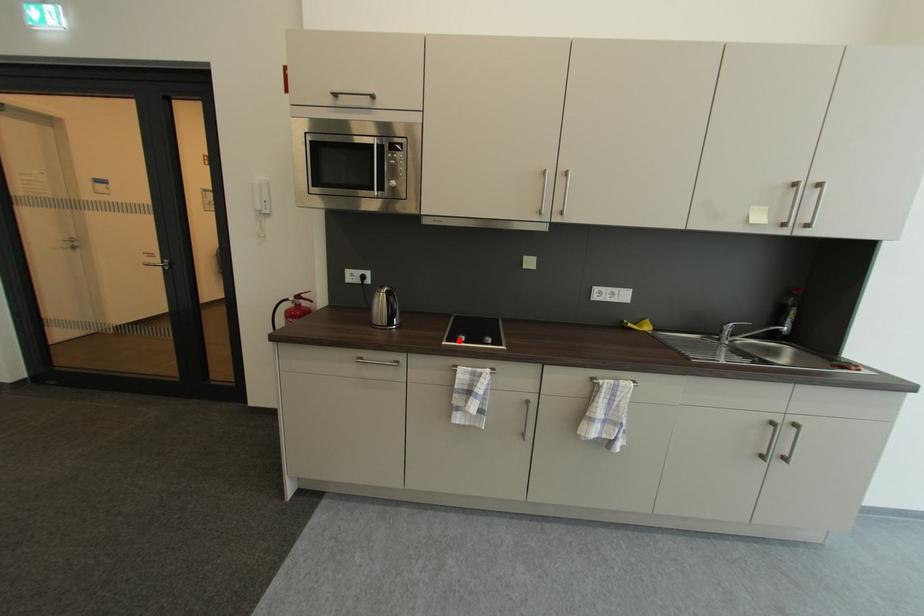
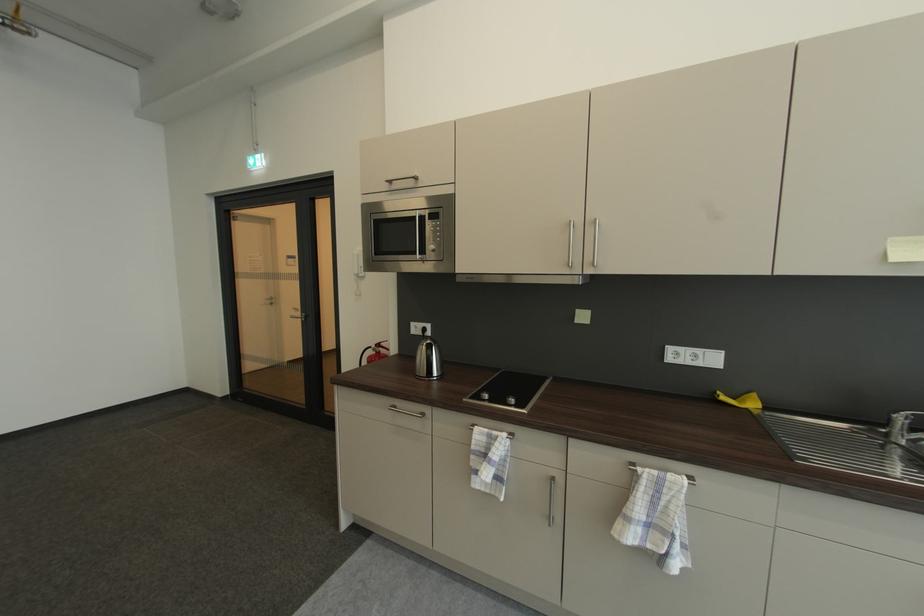
Where in the second image is the point corresponding to the highlighted location from the first image?

(483, 398)